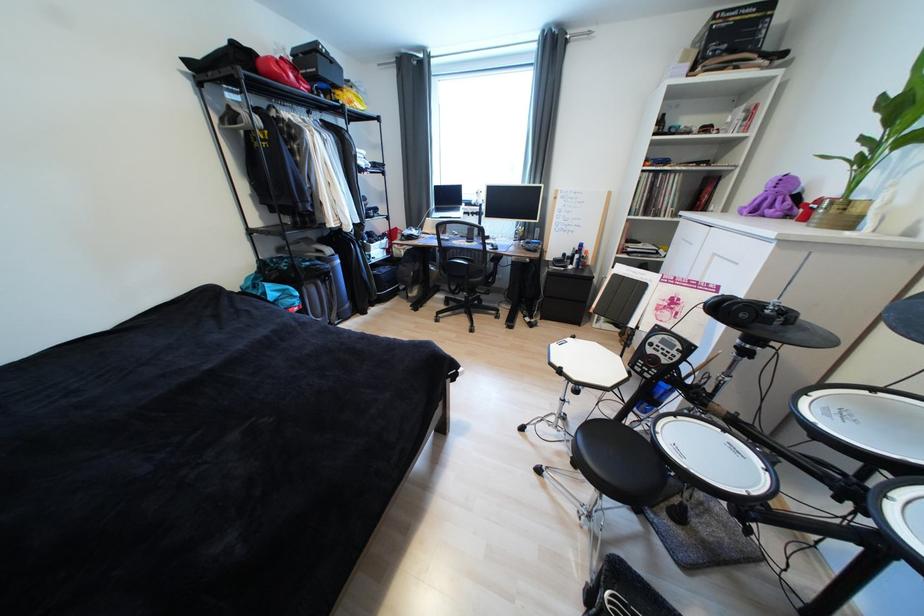
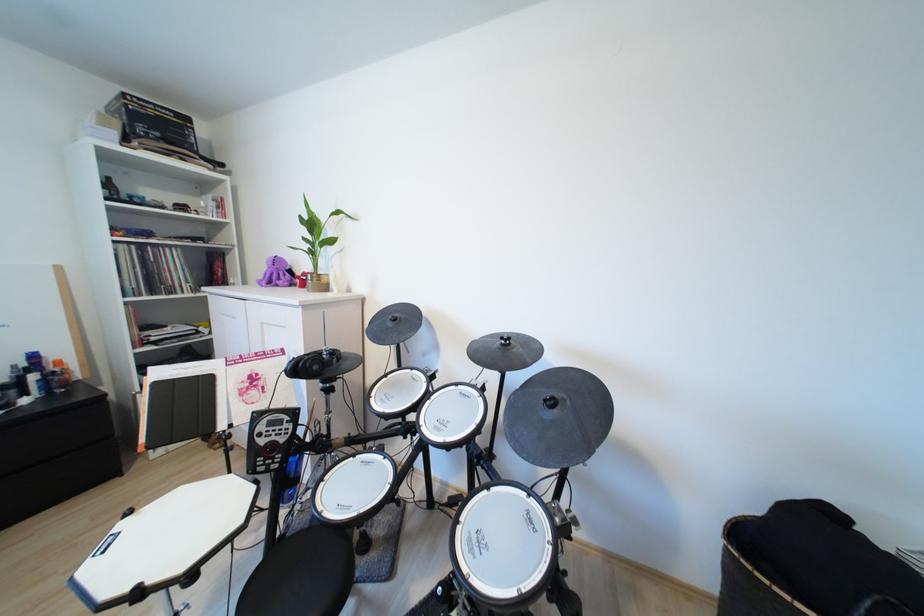
Question: Based on the continuous images, in which direction is the camera rotating? Reply with the corresponding letter.

Choices:
 (A) Left
 (B) Right
 (C) Up
 (D) Down

Answer: (B)